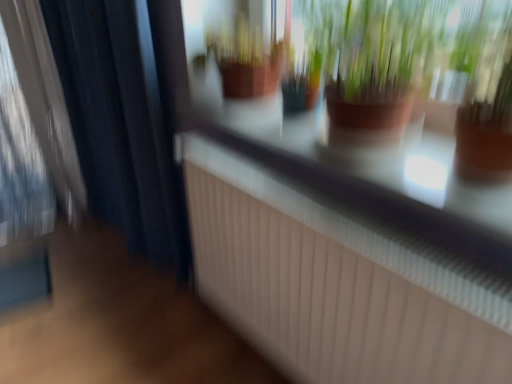
Describe the element at coordinates (412, 110) in the screenshot. I see `brown clay pot at upper center` at that location.

I want to click on brown clay pot at upper center, so click(412, 110).

The width and height of the screenshot is (512, 384). What do you see at coordinates (122, 124) in the screenshot?
I see `dark blue fabric curtain at left` at bounding box center [122, 124].

Where is `dark blue fabric curtain at left`? dark blue fabric curtain at left is located at coordinates (122, 124).

In the scene shown: Measure the distance between dark blue fabric curtain at left and camera.

The depth of dark blue fabric curtain at left is 1.34 meters.

Where is `brown clay pot at upper center`? The height and width of the screenshot is (384, 512). brown clay pot at upper center is located at coordinates (412, 110).

In the scene shown: Does dark blue fabric curtain at left appear on the right side of brown clay pot at upper center?

In fact, dark blue fabric curtain at left is to the left of brown clay pot at upper center.

Based on the photo, is the position of dark blue fabric curtain at left less distant than that of brown clay pot at upper center?

No.

Is point (140, 189) farther from camera compared to point (499, 71)?

Yes.

From the image's perspective, is dark blue fabric curtain at left above brown clay pot at upper center?

Yes.

In the scene shown: From a real-world perspective, is dark blue fabric curtain at left on brown clay pot at upper center?

Incorrect, from a real-world perspective, dark blue fabric curtain at left is lower than brown clay pot at upper center.

Is dark blue fabric curtain at left thinner than brown clay pot at upper center?

Yes, dark blue fabric curtain at left is thinner than brown clay pot at upper center.

Who is taller, dark blue fabric curtain at left or brown clay pot at upper center?

Standing taller between the two is dark blue fabric curtain at left.

Considering the sizes of objects dark blue fabric curtain at left and brown clay pot at upper center in the image provided, who is bigger, dark blue fabric curtain at left or brown clay pot at upper center?

Bigger between the two is dark blue fabric curtain at left.

Would you say dark blue fabric curtain at left contains brown clay pot at upper center?

No, brown clay pot at upper center is located outside of dark blue fabric curtain at left.

Is dark blue fabric curtain at left not close to brown clay pot at upper center?

That's not correct — dark blue fabric curtain at left is a little close to brown clay pot at upper center.

Is brown clay pot at upper center at the back of dark blue fabric curtain at left?

No, dark blue fabric curtain at left is not facing away from brown clay pot at upper center.

How different are the orientations of dark blue fabric curtain at left and brown clay pot at upper center in degrees?

0.000289 degrees.

Identify the location of shop window above the dark blue fabric curtain at left (from a real-world perspective). pyautogui.click(x=412, y=110).

Which object is positioned more to the right, brown clay pot at upper center or dark blue fabric curtain at left?

Positioned to the right is brown clay pot at upper center.

Considering their positions, is brown clay pot at upper center located in front of or behind dark blue fabric curtain at left?

brown clay pot at upper center is positioned closer to the viewer than dark blue fabric curtain at left.

Which point is more forward, [386,154] or [74,24]?

The point [386,154] is closer to the camera.

From the image's perspective, is brown clay pot at upper center above dark blue fabric curtain at left?

No, from the image's perspective, brown clay pot at upper center is not over dark blue fabric curtain at left.

From a real-world perspective, is brown clay pot at upper center positioned above or below dark blue fabric curtain at left?

Clearly, from a real-world perspective, brown clay pot at upper center is above dark blue fabric curtain at left.

Does brown clay pot at upper center have a lesser width compared to dark blue fabric curtain at left?

Incorrect, the width of brown clay pot at upper center is not less than that of dark blue fabric curtain at left.

Between brown clay pot at upper center and dark blue fabric curtain at left, which one has less height?

brown clay pot at upper center.

Considering the relative sizes of brown clay pot at upper center and dark blue fabric curtain at left in the image provided, is brown clay pot at upper center bigger than dark blue fabric curtain at left?

Incorrect, brown clay pot at upper center is not larger than dark blue fabric curtain at left.

Is brown clay pot at upper center spatially inside dark blue fabric curtain at left, or outside of it?

brown clay pot at upper center is spatially situated outside dark blue fabric curtain at left.

Can you see brown clay pot at upper center touching dark blue fabric curtain at left?

No, brown clay pot at upper center is not beside dark blue fabric curtain at left.

Is brown clay pot at upper center turned away from dark blue fabric curtain at left?

No, brown clay pot at upper center is not facing away from dark blue fabric curtain at left.

How different are the orientations of brown clay pot at upper center and dark blue fabric curtain at left in degrees?

brown clay pot at upper center and dark blue fabric curtain at left are facing 0.000289 degrees away from each other.

The image size is (512, 384). What are the coordinates of `curtain above the brown clay pot at upper center (from the image's perspective)` in the screenshot? It's located at (122, 124).

Where is `shop window in front of the dark blue fabric curtain at left`? The height and width of the screenshot is (384, 512). shop window in front of the dark blue fabric curtain at left is located at coordinates (412, 110).

This screenshot has height=384, width=512. In order to click on shop window below the dark blue fabric curtain at left (from the image's perspective) in this screenshot , I will do `click(412, 110)`.